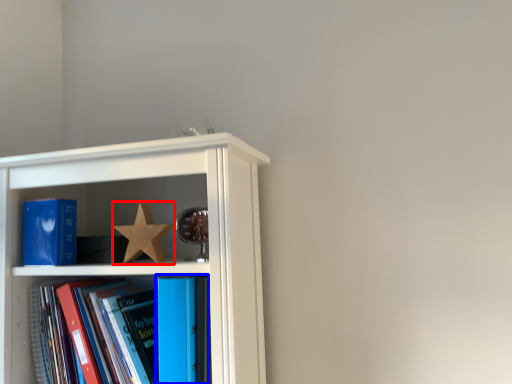
Question: Which object appears farthest to the camera in this image, star (highlighted by a red box) or book (highlighted by a blue box)?

Choices:
 (A) star
 (B) book

Answer: (A)